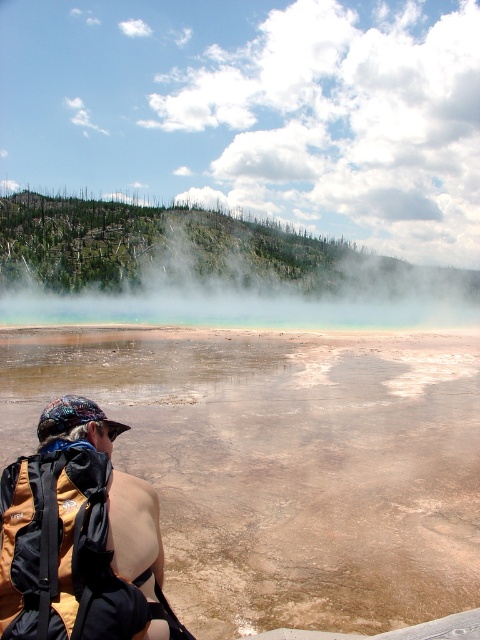
You are a photographer trying to capture the entire scene of the hot spring. You notice the white misty steam at upper center and the brown fabric backpack at lower left. Which object takes up more space in your photo?

The white misty steam at upper center takes up more space in the photo because it is larger in size than the brown fabric backpack at lower left.

You are a geologist analyzing the hot spring scene. You need to locate the brown sedimentary water at center for your study. According to the coordinates provided, where exactly should you focus your equipment?

The brown sedimentary water at center is located at coordinates point (283, 464), so you should focus your equipment there.

You are a photographer trying to capture the steam rising from the hot spring. You have a camera with a 1.2 meter focal length. The white misty steam at upper center and the brown fabric backpack at lower left are in your frame. Which object is taller in the photo?

The white misty steam at upper center is taller than the brown fabric backpack at lower left in the photo.